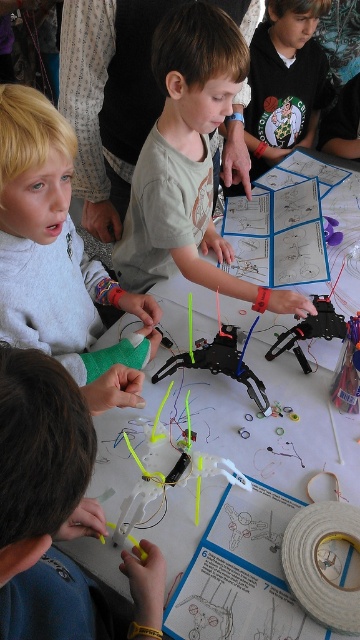
Does yellow plastic toy at center appear over neon yellow plastic propeller at center?

No.

Is yellow plastic toy at center closer to camera compared to neon yellow plastic propeller at center?

That is True.

Where is `yellow plastic toy at center`? The image size is (360, 640). yellow plastic toy at center is located at coordinates coord(45,500).

Does yellow plastic toy at center appear under matte black robot at center?

Indeed, yellow plastic toy at center is positioned under matte black robot at center.

Is point (60, 512) farther from viewer compared to point (330, 326)?

No, it is not.

I want to click on yellow plastic toy at center, so click(45, 500).

Does white paper at center have a lesser width compared to matte black robot at center?

Incorrect, white paper at center's width is not less than matte black robot at center's.

Is point (299, 417) farther from camera compared to point (334, 324)?

No.

Which is behind, point (226, 403) or point (293, 348)?

The point (293, 348) is more distant.

Find the location of `white paper at center`. white paper at center is located at coordinates (245, 420).